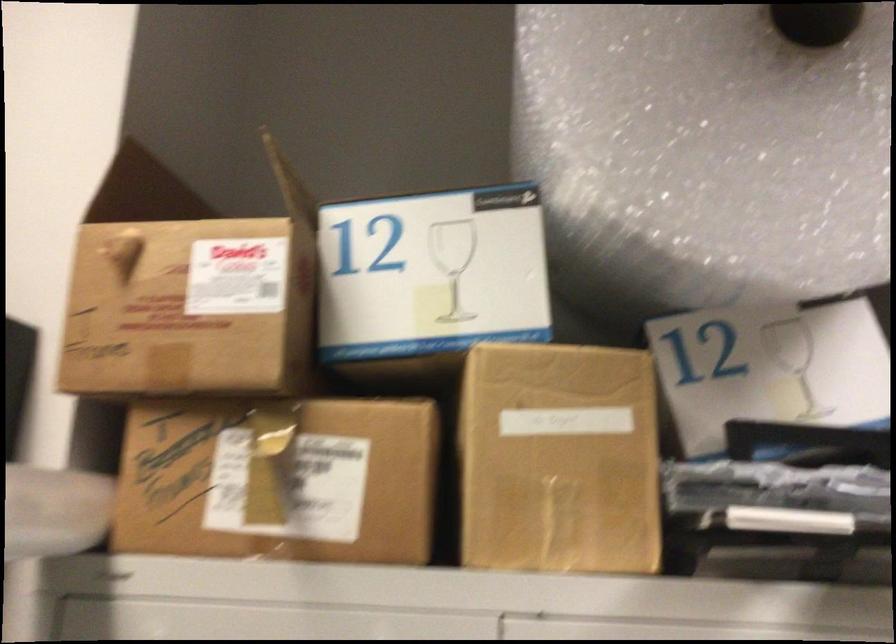
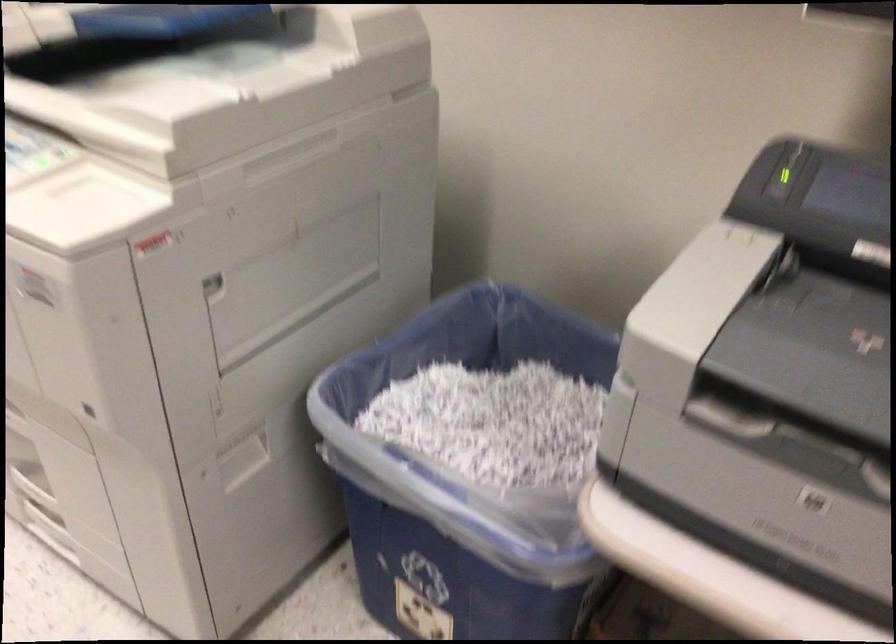
First-person continuous shooting, in which direction is the camera rotating?

The camera rotated toward right-down.